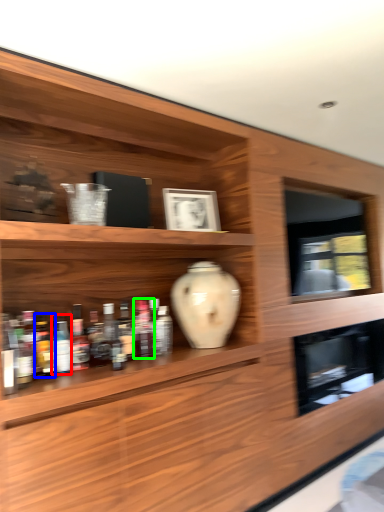
Question: Based on their relative distances, which object is nearer to bottle (highlighted by a red box)? Choose from bottle (highlighted by a blue box) and bottle (highlighted by a green box).

Choices:
 (A) bottle
 (B) bottle

Answer: (A)